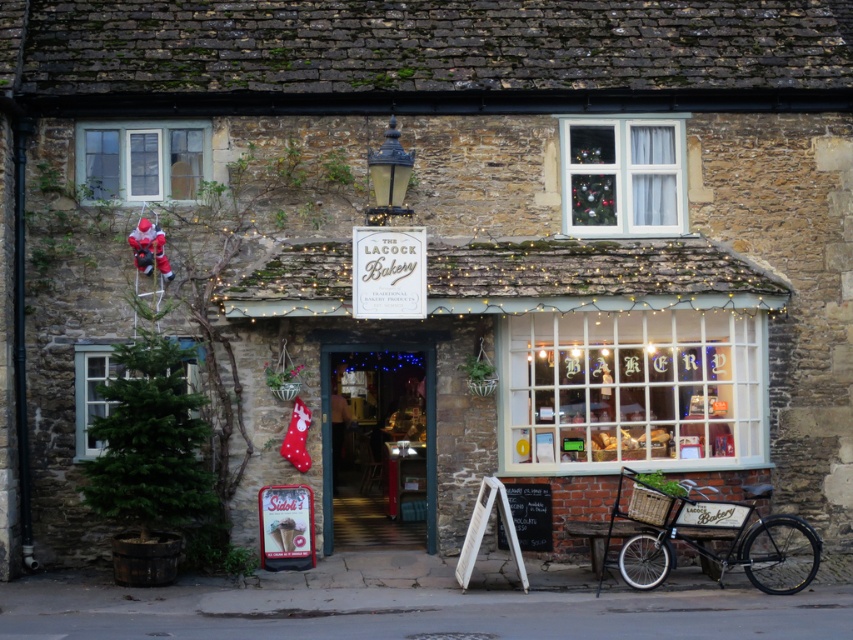
Question: Estimate the real-world distances between objects in this image. Which object is closer to the black metal bicycle at lower right?

Choices:
 (A) white plastic window at upper center
 (B) white frosted glass bakery sign at center

Answer: (B)

Question: Which point is closer to the camera?

Choices:
 (A) green matte christmas tree at lower left
 (B) black metal bicycle at lower right

Answer: (B)

Question: Can you confirm if white plastic window at upper center is positioned above clear glass window at upper left?

Choices:
 (A) yes
 (B) no

Answer: (B)

Question: Which of the following is the closest to the observer?

Choices:
 (A) matte white bakery at center
 (B) clear glass window at upper left

Answer: (A)

Question: Where is black metal bicycle at lower right located in relation to clear glass window at upper left in the image?

Choices:
 (A) below
 (B) above

Answer: (A)

Question: Considering the relative positions of clear glass window at upper left and green matte christmas tree at lower left in the image provided, where is clear glass window at upper left located with respect to green matte christmas tree at lower left?

Choices:
 (A) below
 (B) above

Answer: (B)